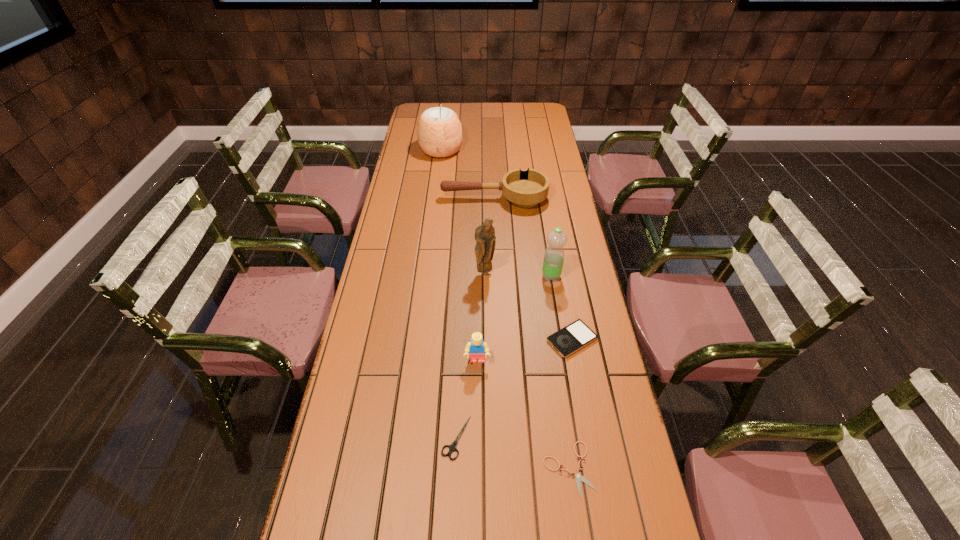
Find the location of a particular element. Image resolution: width=960 pixels, height=540 pixels. the right shears is located at coordinates (578, 476).

Find the location of a particular element. This screenshot has height=540, width=960. blank space located on the left of the farthest object is located at coordinates (408, 151).

The width and height of the screenshot is (960, 540). What are the coordinates of `free spot located 0.280m on the front-facing side of the figurine` in the screenshot? It's located at (486, 344).

Identify the location of free location located on the left of the water bottle. Image resolution: width=960 pixels, height=540 pixels. (477, 276).

Where is `vacant space situated on the front-facing side of the Lego`? vacant space situated on the front-facing side of the Lego is located at coordinates (476, 508).

At what (x,y) coordinates should I click in order to perform the action: click on free region located with the handle on the side of the fifth tallest object. Please return your answer as a coordinate pair (x, y). Image resolution: width=960 pixels, height=540 pixels. Looking at the image, I should click on (417, 199).

At what (x,y) coordinates should I click in order to perform the action: click on free space located with the handle on the side of the fifth tallest object. Please return your answer as a coordinate pair (x, y). The image size is (960, 540). Looking at the image, I should click on (429, 199).

Identify the location of vacant space situated 0.170m with the handle on the side of the fifth tallest object. (400, 199).

I want to click on vacant space positioned on the back of the sixth tallest object, so click(555, 248).

Find the location of a particular element. This screenshot has height=540, width=960. vacant region located on the front of the left shears is located at coordinates (453, 521).